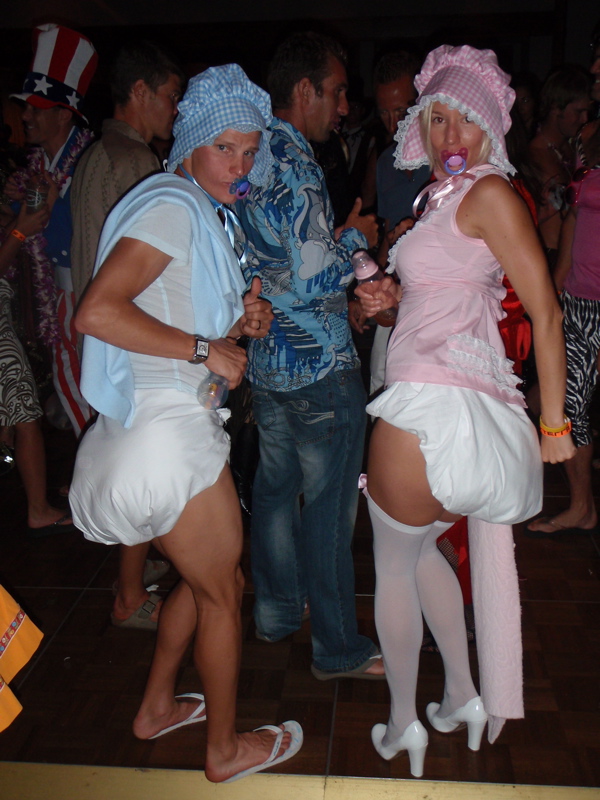
Identify the location of stockings. The image size is (600, 800). (403, 622), (452, 617).